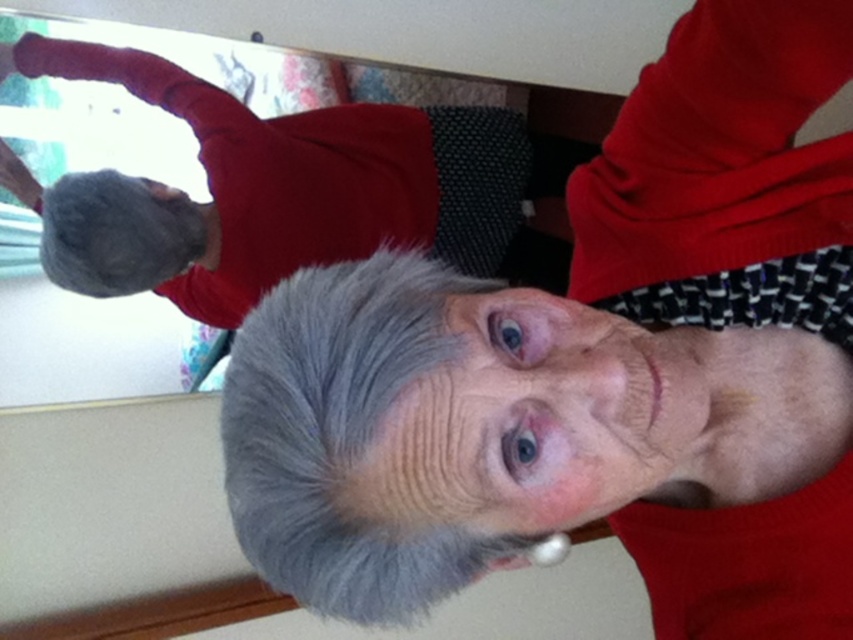
You are an interior designer assessing the rotated image. You need to place a decorative item between the gray fluffy hair at center and the fuzzy wool glove at upper left. Based on their positions, where should you position the item?

The gray fluffy hair at center is to the right of the fuzzy wool glove at upper left, so the decorative item should be placed between them, to the right of the fuzzy wool glove at upper left and to the left of the gray fluffy hair at center.

You are an interior designer assessing the rotated image for spatial planning. Based on the scene, which object takes up more space in the image between the gray fluffy hair at center and the fuzzy wool glove at upper left?

The fuzzy wool glove at upper left takes up more space in the image than the gray fluffy hair at center because the gray fluffy hair at center occupies less space than fuzzy wool glove at upper left.

You are an interior designer assessing the rotated image. You need to determine if the gray fluffy hair at center will fit under a shelf that is currently at the height of the fuzzy wool glove at upper left. Can it fit?

The gray fluffy hair at center is not as tall as the fuzzy wool glove at upper left, so it will fit under the shelf at the height of the fuzzy wool glove at upper left.